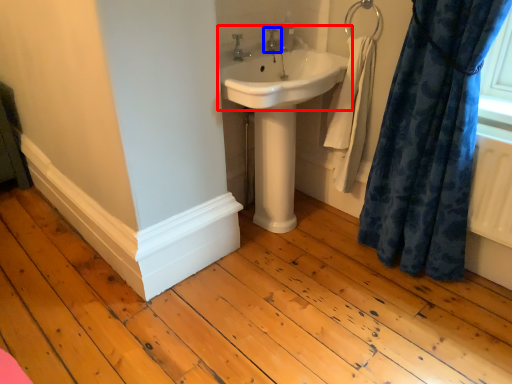
Question: Which of the following is the farthest to the observer, sink (highlighted by a red box) or tap (highlighted by a blue box)?

Choices:
 (A) sink
 (B) tap

Answer: (B)